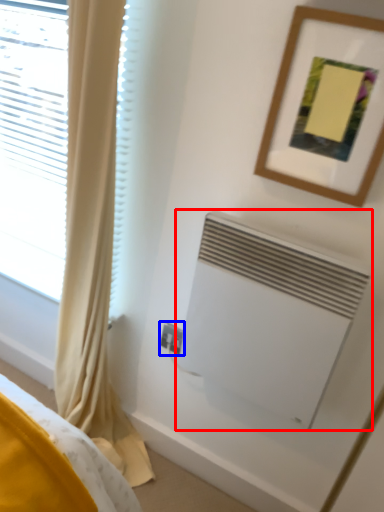
Question: Among these objects, which one is farthest to the camera, air conditioning (highlighted by a red box) or electric outlet (highlighted by a blue box)?

Choices:
 (A) air conditioning
 (B) electric outlet

Answer: (B)